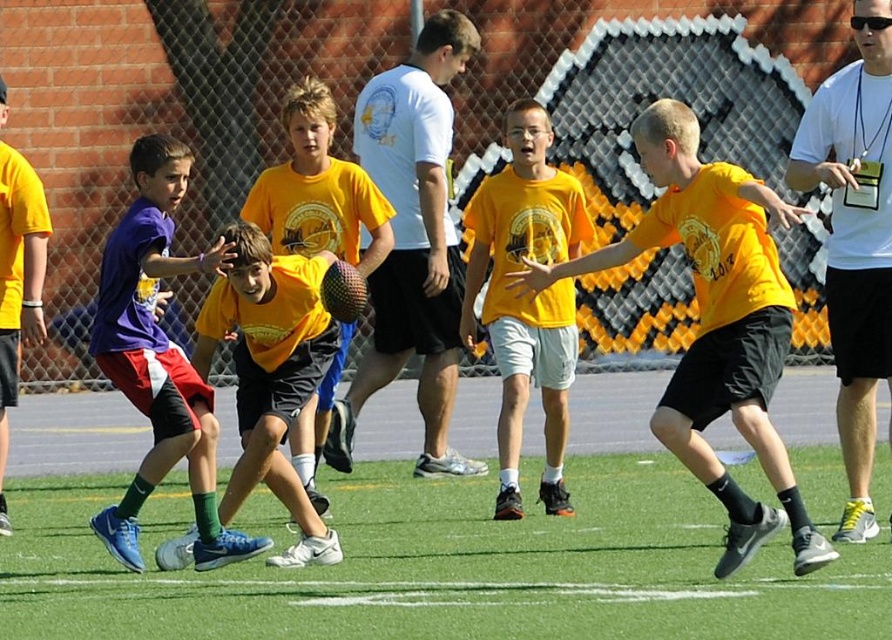
From the picture: Based on the scene description, which object is larger in size between the white matte shirt at center and the purple matte shirt at left?

The white matte shirt at center is larger than the purple matte shirt at left.

You are a photographer trying to capture a clear shot of both the purple matte shirt at left and the matte yellow shirt at center. Based on their sizes in the image, which one should you focus on first to ensure it fits within your camera frame?

The purple matte shirt at left is larger in size than the matte yellow shirt at center, so you should focus on the purple matte shirt at left first to ensure it fits within your camera frame.

You are a photographer trying to capture a photo of the white matte shirt at center and the purple matte shirt at left. Based on their heights, which one should you focus on first to ensure both are in frame?

The white matte shirt at center is much taller than the purple matte shirt at left, so you should focus on the white matte shirt at center first to ensure both are in frame.